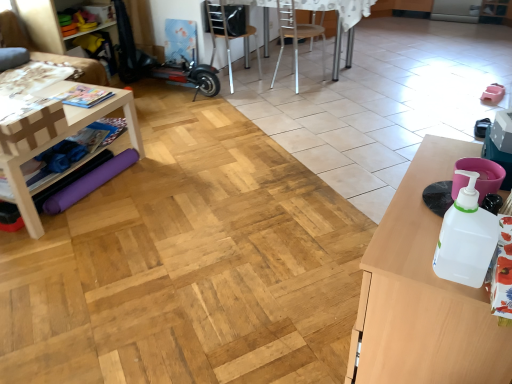
Question: Considering the relative positions of white plastic bottle at right and white wood table at left, marked as the first table in a back-to-front arrangement, in the image provided, is white plastic bottle at right to the right of white wood table at left, marked as the first table in a back-to-front arrangement, from the viewer's perspective?

Choices:
 (A) yes
 (B) no

Answer: (A)

Question: From the image's perspective, does white plastic bottle at right appear lower than white wood table at left, which is counted as the second table, starting from the front?

Choices:
 (A) yes
 (B) no

Answer: (A)

Question: Considering the relative sizes of white plastic bottle at right and white wood table at left, placed as the second table when sorted from right to left, in the image provided, is white plastic bottle at right bigger than white wood table at left, placed as the second table when sorted from right to left,?

Choices:
 (A) no
 (B) yes

Answer: (A)

Question: Does white plastic bottle at right have a smaller size compared to white wood table at left, the first table positioned from the left?

Choices:
 (A) no
 (B) yes

Answer: (B)

Question: Is the depth of white plastic bottle at right less than that of white wood table at left, placed as the second table when sorted from right to left?

Choices:
 (A) no
 (B) yes

Answer: (B)

Question: From a real-world perspective, is metallic silver chair at center, which ranks as the first chair in right-to-left order, above or below white plastic bottle at right?

Choices:
 (A) above
 (B) below

Answer: (B)

Question: Considering the positions of metallic silver chair at center, the 2th chair in the left-to-right sequence, and white plastic bottle at right in the image, is metallic silver chair at center, the 2th chair in the left-to-right sequence, taller or shorter than white plastic bottle at right?

Choices:
 (A) short
 (B) tall

Answer: (B)

Question: Do you think metallic silver chair at center, which ranks as the first chair in right-to-left order, is within white plastic bottle at right, or outside of it?

Choices:
 (A) inside
 (B) outside

Answer: (B)

Question: In the image, is metallic silver chair at center, which ranks as the first chair in right-to-left order, positioned in front of or behind white plastic bottle at right?

Choices:
 (A) behind
 (B) front

Answer: (A)

Question: Is white plastic bottle at right bigger or smaller than brown fabric couch at left?

Choices:
 (A) big
 (B) small

Answer: (B)

Question: Do you think white plastic bottle at right is within brown fabric couch at left, or outside of it?

Choices:
 (A) inside
 (B) outside

Answer: (B)

Question: Relative to brown fabric couch at left, is white plastic bottle at right in front or behind?

Choices:
 (A) behind
 (B) front

Answer: (B)

Question: Considering the positions of white plastic bottle at right and brown fabric couch at left in the image, is white plastic bottle at right taller or shorter than brown fabric couch at left?

Choices:
 (A) tall
 (B) short

Answer: (B)

Question: From their relative heights in the image, would you say brown fabric couch at left is taller or shorter than metallic silver table at center?

Choices:
 (A) tall
 (B) short

Answer: (A)

Question: Based on their sizes in the image, would you say brown fabric couch at left is bigger or smaller than metallic silver table at center?

Choices:
 (A) small
 (B) big

Answer: (A)